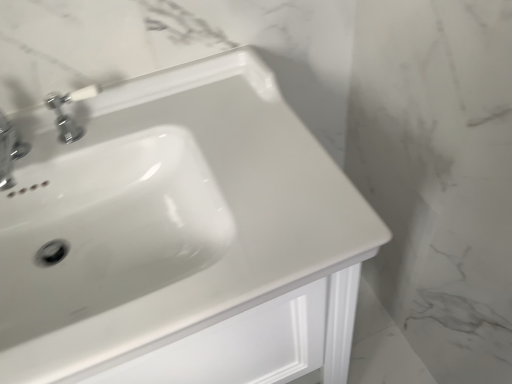
Identify the location of chrome metallic faucet at upper left, which is the 1th tap from left to right. (9, 151).

This screenshot has height=384, width=512. Identify the location of chrome metallic faucet at upper left, which is the 1th tap from left to right. click(x=9, y=151).

Consider the image. Looking at the image, does white glossy sink at center seem bigger or smaller compared to chrome metallic faucet at upper left, which is the 1th tap from left to right?

In the image, white glossy sink at center appears to be larger than chrome metallic faucet at upper left, which is the 1th tap from left to right.

Does white glossy sink at center appear on the left side of chrome metallic faucet at upper left, which is the 1th tap from left to right?

In fact, white glossy sink at center is to the right of chrome metallic faucet at upper left, which is the 1th tap from left to right.

At what (x,y) coordinates should I click in order to perform the action: click on sink lying on the right of chrome metallic faucet at upper left, which is the 1th tap from left to right. Please return your answer as a coordinate pair (x, y). Looking at the image, I should click on [181, 238].

Is white glossy sink at center taller or shorter than chrome metallic faucet at upper left, which is the second tap in left-to-right order?

white glossy sink at center is taller than chrome metallic faucet at upper left, which is the second tap in left-to-right order.

Is white glossy sink at center oriented towards chrome metallic faucet at upper left, the first tap when ordered from right to left?

No, white glossy sink at center is not facing towards chrome metallic faucet at upper left, the first tap when ordered from right to left.

This screenshot has height=384, width=512. I want to click on sink below the chrome metallic faucet at upper left, which is the second tap in left-to-right order (from a real-world perspective), so click(181, 238).

Is white glossy sink at center smaller than chrome metallic faucet at upper left, the first tap when ordered from right to left?

Actually, white glossy sink at center might be larger than chrome metallic faucet at upper left, the first tap when ordered from right to left.

This screenshot has width=512, height=384. In order to click on the 2nd tap counting from the left side of the white glossy sink at center in this screenshot , I will do `click(9, 151)`.

From the image's perspective, which is below, chrome metallic faucet at upper left, placed as the second tap when sorted from right to left, or white glossy sink at center?

white glossy sink at center, from the image's perspective.

Is chrome metallic faucet at upper left, which is the 1th tap from left to right, taller or shorter than white glossy sink at center?

In the image, chrome metallic faucet at upper left, which is the 1th tap from left to right, appears to be shorter than white glossy sink at center.

Between chrome metallic faucet at upper left, placed as the second tap when sorted from right to left, and white glossy sink at center, which one has larger width?

Wider between the two is white glossy sink at center.

Is chrome metallic faucet at upper left, the first tap when ordered from right to left, to the right of chrome metallic faucet at upper left, which is the 1th tap from left to right, from the viewer's perspective?

Yes.

Which of these two, chrome metallic faucet at upper left, the first tap when ordered from right to left, or chrome metallic faucet at upper left, placed as the second tap when sorted from right to left, is wider?

With larger width is chrome metallic faucet at upper left, placed as the second tap when sorted from right to left.

Looking at this image, from a real-world perspective, is chrome metallic faucet at upper left, which is the second tap in left-to-right order, positioned under chrome metallic faucet at upper left, placed as the second tap when sorted from right to left, based on gravity?

Yes, from a real-world perspective, chrome metallic faucet at upper left, which is the second tap in left-to-right order, is beneath chrome metallic faucet at upper left, placed as the second tap when sorted from right to left.

Are chrome metallic faucet at upper left, which is the second tap in left-to-right order, and chrome metallic faucet at upper left, placed as the second tap when sorted from right to left, far apart?

No, there isn't a large distance between chrome metallic faucet at upper left, which is the second tap in left-to-right order, and chrome metallic faucet at upper left, placed as the second tap when sorted from right to left.

Who is smaller, chrome metallic faucet at upper left, the first tap when ordered from right to left, or white glossy sink at center?

Smaller between the two is chrome metallic faucet at upper left, the first tap when ordered from right to left.

Can you confirm if chrome metallic faucet at upper left, which is the second tap in left-to-right order, is positioned to the left of white glossy sink at center?

Indeed, chrome metallic faucet at upper left, which is the second tap in left-to-right order, is positioned on the left side of white glossy sink at center.

Locate an element on the screen. sink to the right of chrome metallic faucet at upper left, the first tap when ordered from right to left is located at coordinates (181, 238).

Does chrome metallic faucet at upper left, which is the second tap in left-to-right order, turn towards white glossy sink at center?

No, chrome metallic faucet at upper left, which is the second tap in left-to-right order, does not turn towards white glossy sink at center.

Is chrome metallic faucet at upper left, placed as the second tap when sorted from right to left, wider or thinner than chrome metallic faucet at upper left, which is the second tap in left-to-right order?

chrome metallic faucet at upper left, placed as the second tap when sorted from right to left, is wider than chrome metallic faucet at upper left, which is the second tap in left-to-right order.

Is chrome metallic faucet at upper left, placed as the second tap when sorted from right to left, looking in the opposite direction of chrome metallic faucet at upper left, which is the second tap in left-to-right order?

chrome metallic faucet at upper left, placed as the second tap when sorted from right to left, does not have its back to chrome metallic faucet at upper left, which is the second tap in left-to-right order.

From the image's perspective, relative to chrome metallic faucet at upper left, which is the second tap in left-to-right order, is chrome metallic faucet at upper left, which is the 1th tap from left to right, above or below?

Clearly, from the image's perspective, chrome metallic faucet at upper left, which is the 1th tap from left to right, is below chrome metallic faucet at upper left, which is the second tap in left-to-right order.

Measure the distance from chrome metallic faucet at upper left, which is the 1th tap from left to right, to chrome metallic faucet at upper left, the first tap when ordered from right to left.

chrome metallic faucet at upper left, which is the 1th tap from left to right, and chrome metallic faucet at upper left, the first tap when ordered from right to left, are 10.18 centimeters apart.

Find the location of a particular element. This screenshot has height=384, width=512. the 1st tap above the white glossy sink at center (from the image's perspective) is located at coordinates (9, 151).

Identify the location of sink located underneath the chrome metallic faucet at upper left, which is the second tap in left-to-right order (from a real-world perspective). The width and height of the screenshot is (512, 384). (181, 238).

When comparing their distances from white glossy sink at center, does chrome metallic faucet at upper left, which is the second tap in left-to-right order, or chrome metallic faucet at upper left, placed as the second tap when sorted from right to left, seem further?

chrome metallic faucet at upper left, placed as the second tap when sorted from right to left, lies further to white glossy sink at center than the other object.

Which object lies further to the anchor point chrome metallic faucet at upper left, placed as the second tap when sorted from right to left, white glossy sink at center or chrome metallic faucet at upper left, which is the second tap in left-to-right order?

white glossy sink at center lies further to chrome metallic faucet at upper left, placed as the second tap when sorted from right to left, than the other object.

Estimate the real-world distances between objects in this image. Which object is further from chrome metallic faucet at upper left, which is the second tap in left-to-right order, chrome metallic faucet at upper left, which is the 1th tap from left to right, or white glossy sink at center?

white glossy sink at center lies further to chrome metallic faucet at upper left, which is the second tap in left-to-right order, than the other object.

Which object lies nearer to the anchor point chrome metallic faucet at upper left, the first tap when ordered from right to left, white glossy sink at center or chrome metallic faucet at upper left, which is the 1th tap from left to right?

Among the two, chrome metallic faucet at upper left, which is the 1th tap from left to right, is located nearer to chrome metallic faucet at upper left, the first tap when ordered from right to left.

Which object lies further to the anchor point white glossy sink at center, chrome metallic faucet at upper left, placed as the second tap when sorted from right to left, or chrome metallic faucet at upper left, the first tap when ordered from right to left?

chrome metallic faucet at upper left, placed as the second tap when sorted from right to left, is positioned further to the anchor white glossy sink at center.

Estimate the real-world distances between objects in this image. Which object is further from chrome metallic faucet at upper left, which is the 1th tap from left to right, chrome metallic faucet at upper left, which is the second tap in left-to-right order, or white glossy sink at center?

Among the two, white glossy sink at center is located further to chrome metallic faucet at upper left, which is the 1th tap from left to right.

Where is `tap between white glossy sink at center and chrome metallic faucet at upper left, which is the second tap in left-to-right order, along the z-axis`? tap between white glossy sink at center and chrome metallic faucet at upper left, which is the second tap in left-to-right order, along the z-axis is located at coordinates (9, 151).